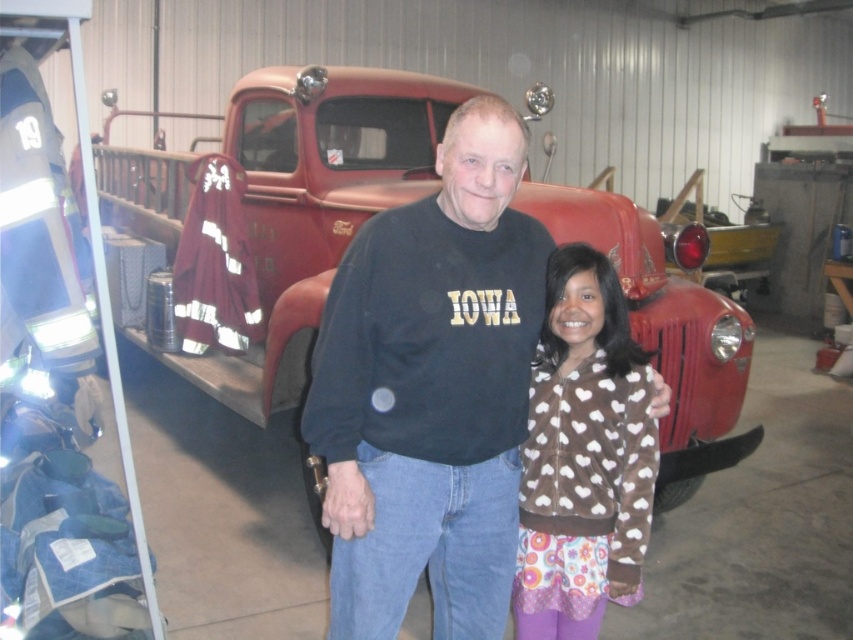
You are a delivery person who needs to place a package between the black cotton sweatshirt at center and the metallic red truck at center. The package requires 3 feet of space to be placed safely. Is there enough space between them?

The black cotton sweatshirt at center and metallic red truck at center are 5.64 feet apart from each other. Since the required space is 3 feet, there is sufficient space to place the package safely between them.

You are trying to decide which clothing item to take for a casual day out. Both the black cotton sweatshirt at center and the brown fleece jacket at center are available. Based on their sizes, which one offers more coverage for your upper body?

The black cotton sweatshirt at center has a greater width than the brown fleece jacket at center, so it offers more coverage for your upper body.

You are a photographer setting up a shoot in the garage. You need to ensure that both the black cotton sweatshirt at center and the brown fleece jacket at center are visible in the photo. Based on their positions, which one might be partially hidden if you frame the shot from the front?

The black cotton sweatshirt at center is in front of the brown fleece jacket at center, so the brown fleece jacket at center might be partially hidden if framed from the front.